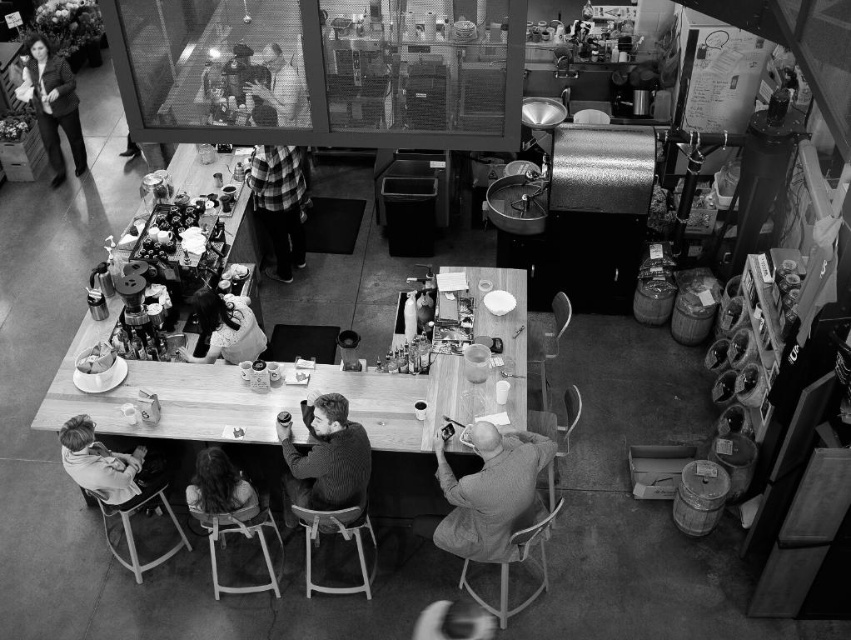
Who is positioned more to the left, long hair at lower center or smooth leather jacket at center?

Positioned to the left is long hair at lower center.

I want to click on long hair at lower center, so click(x=220, y=486).

Where is `long hair at lower center`? This screenshot has width=851, height=640. long hair at lower center is located at coordinates (220, 486).

I want to click on long hair at lower center, so click(220, 486).

Who is higher up, knitted sweater at center or long hair at lower center?

knitted sweater at center

Does knitted sweater at center appear over long hair at lower center?

Yes, knitted sweater at center is above long hair at lower center.

Where is `knitted sweater at center`? knitted sweater at center is located at coordinates (324, 458).

Can you confirm if knitted sweater at center is taller than smooth leather jacket at center?

Indeed, knitted sweater at center has a greater height compared to smooth leather jacket at center.

Identify the location of knitted sweater at center. Image resolution: width=851 pixels, height=640 pixels. (324, 458).